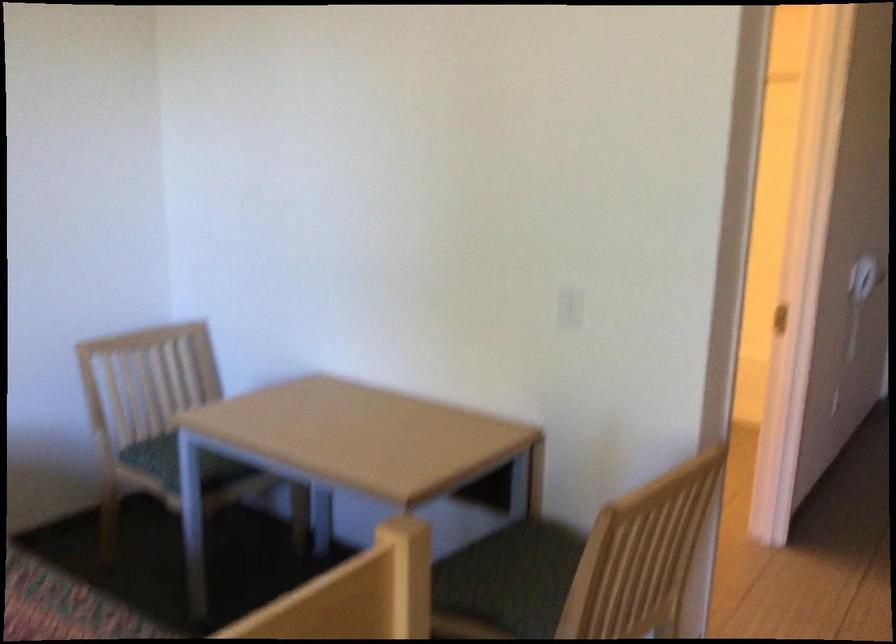
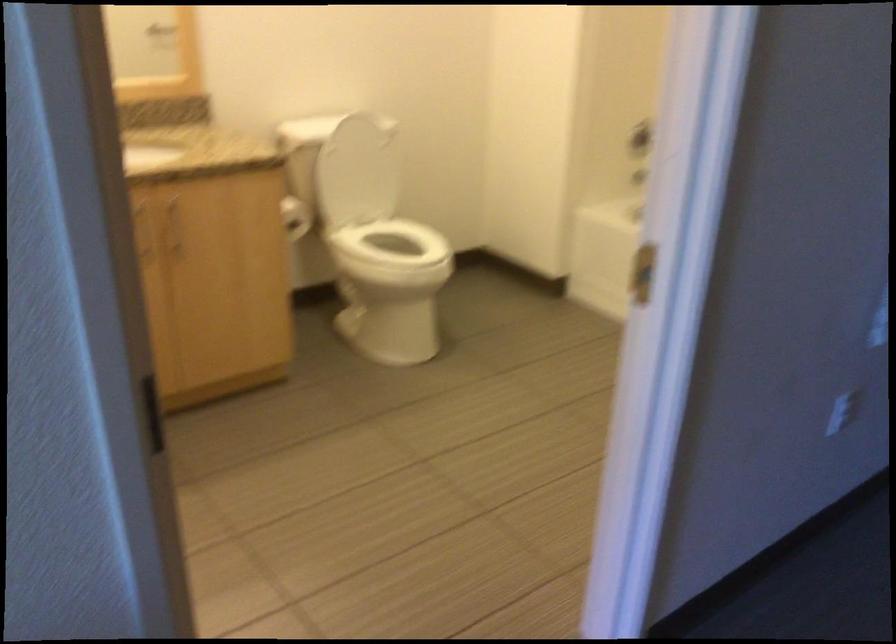
In a continuous first-person perspective shot, in which direction is the camera moving?

The cameraman moved toward right, forward.